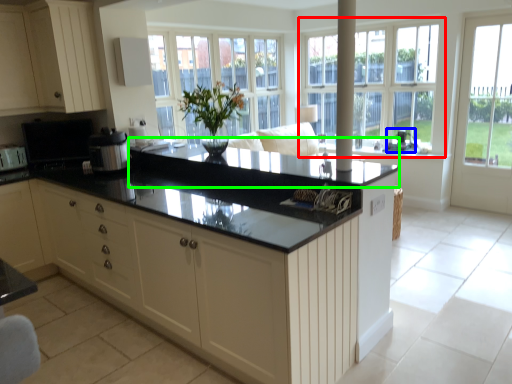
Question: Which object is positioned closest to window (highlighted by a red box)? Select from appliance (highlighted by a blue box) and countertop (highlighted by a green box).

Choices:
 (A) appliance
 (B) countertop

Answer: (A)